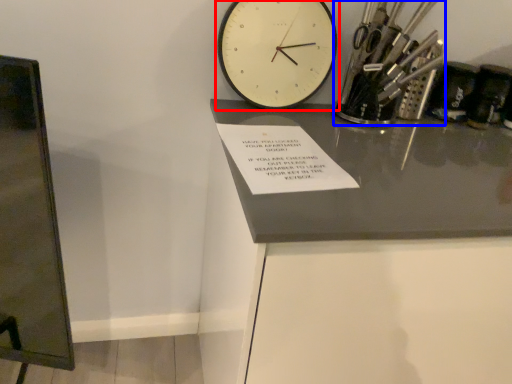
Question: Which object appears closest to the camera in this image, wall clock (highlighted by a red box) or stationery (highlighted by a blue box)?

Choices:
 (A) wall clock
 (B) stationery

Answer: (A)